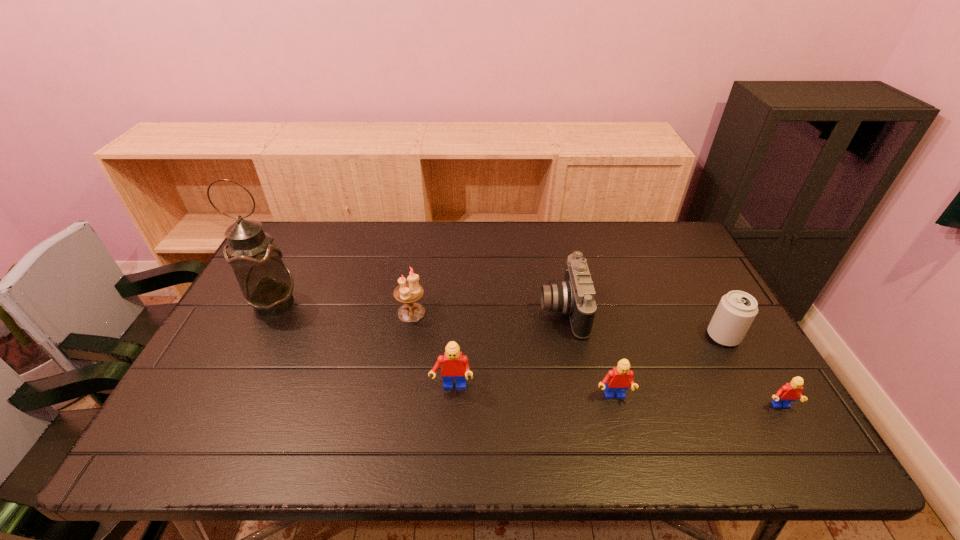
What are the coordinates of `vacant region between the camera and the second shortest Lego` in the screenshot? It's located at (588, 354).

This screenshot has height=540, width=960. I want to click on vacant area that lies between the candle holder and the shortest Lego, so click(595, 360).

Where is `vacant space that's between the sixth object from right to left and the shortest object`? vacant space that's between the sixth object from right to left and the shortest object is located at coordinates (595, 360).

You are a GUI agent. You are given a task and a screenshot of the screen. Output one action in this format:
    pyautogui.click(x=<x>, y=<y>)
    Task: Click on the vacant area that lies between the second tallest Lego and the tallest Lego
    
    Given the screenshot: What is the action you would take?
    pyautogui.click(x=532, y=393)

The image size is (960, 540). In order to click on free spot between the oil lamp and the can in this screenshot , I will do `click(498, 320)`.

The width and height of the screenshot is (960, 540). I want to click on free point between the shortest object and the second Lego from right to left, so click(696, 402).

The height and width of the screenshot is (540, 960). Find the location of `vacant region between the candle holder and the shortest Lego`. vacant region between the candle holder and the shortest Lego is located at coordinates (595, 360).

The image size is (960, 540). I want to click on object that stands as the closest to the leftmost Lego, so click(x=410, y=292).

Locate which object is the sixth closest to the second Lego from right to left. Please provide its 2D coordinates. Your answer should be formatted as a tuple, i.e. [(x, y)], where the tuple contains the x and y coordinates of a point satisfying the conditions above.

[(266, 282)]

Where is `Lego that stands as the third closest to the candle holder`? The width and height of the screenshot is (960, 540). Lego that stands as the third closest to the candle holder is located at coordinates (791, 391).